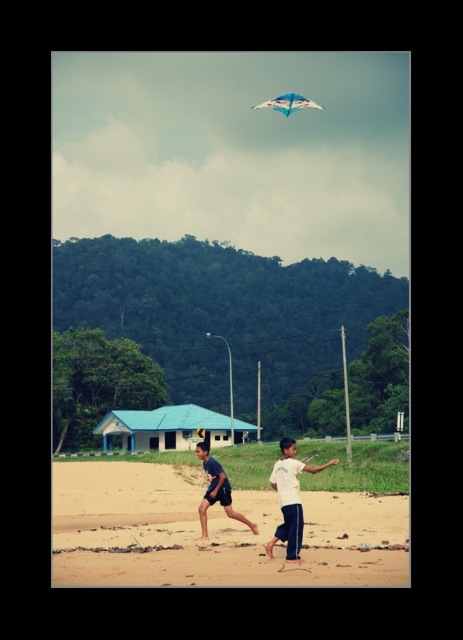
Question: Among these points, which one is farthest from the camera?

Choices:
 (A) (274, 109)
 (B) (349, 493)
 (C) (298, 467)
 (D) (225, 486)

Answer: (A)

Question: Which of these objects is positioned farthest from the sandy beach at lower center?

Choices:
 (A) white cotton shirt at center
 (B) dark blue fabric shorts at center

Answer: (B)

Question: Which object is the farthest from the white cotton shirt at center?

Choices:
 (A) dark blue fabric shorts at center
 (B) sandy beach at lower center
 (C) translucent blue kite at upper center

Answer: (C)

Question: Does white cotton shirt at center have a smaller size compared to translucent blue kite at upper center?

Choices:
 (A) yes
 (B) no

Answer: (A)

Question: Does sandy beach at lower center come behind translucent blue kite at upper center?

Choices:
 (A) no
 (B) yes

Answer: (A)

Question: Can you confirm if sandy beach at lower center is positioned below white cotton shirt at center?

Choices:
 (A) yes
 (B) no

Answer: (A)